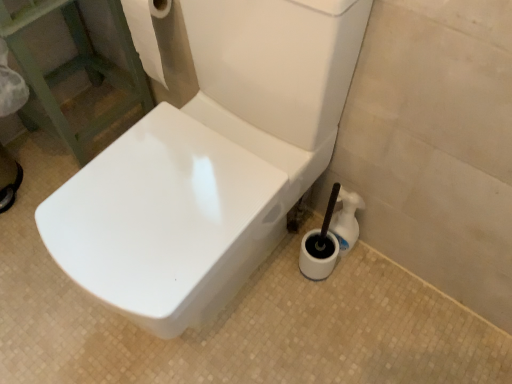
Locate an element on the screen. This screenshot has height=384, width=512. white glossy toilet brush at lower right is located at coordinates (346, 220).

Describe the element at coordinates (210, 162) in the screenshot. I see `white glossy toilet at center` at that location.

Identify the location of white paper towel at upper left. The image size is (512, 384). (147, 32).

The height and width of the screenshot is (384, 512). I want to click on white glossy toilet brush at lower right, so click(x=346, y=220).

Based on the photo, is white paper towel at upper left directly adjacent to white glossy toilet brush at lower right?

No, white paper towel at upper left is not touching white glossy toilet brush at lower right.

Is point (144, 39) positioned before point (346, 192)?

No.

Is white paper towel at upper left looking in the opposite direction of white glossy toilet brush at lower right?

That's not correct — white paper towel at upper left is not looking away from white glossy toilet brush at lower right.

Is white glossy toilet brush at lower right inside white paper towel at upper left?

No, white glossy toilet brush at lower right is not inside white paper towel at upper left.

Considering the relative sizes of white glossy toilet brush at lower right and white paper towel at upper left in the image provided, is white glossy toilet brush at lower right taller than white paper towel at upper left?

Incorrect, the height of white glossy toilet brush at lower right is not larger of that of white paper towel at upper left.

You are a GUI agent. You are given a task and a screenshot of the screen. Output one action in this format:
    pyautogui.click(x=<x>, y=<y>)
    Task: Click on the cleaning product behind the white paper towel at upper left
    The width and height of the screenshot is (512, 384).
    Given the screenshot: What is the action you would take?
    pyautogui.click(x=346, y=220)

Considering the sizes of objects white glossy toilet brush at lower right and white paper towel at upper left in the image provided, who is bigger, white glossy toilet brush at lower right or white paper towel at upper left?

white paper towel at upper left is bigger.

Considering the relative sizes of white glossy toilet brush at lower right and white paper towel at upper left in the image provided, is white glossy toilet brush at lower right wider than white paper towel at upper left?

In fact, white glossy toilet brush at lower right might be narrower than white paper towel at upper left.

Would you say white glossy toilet at center is a long distance from white glossy toilet brush at lower right?

No, white glossy toilet at center is not far away from white glossy toilet brush at lower right.

Is white glossy toilet at center not inside white glossy toilet brush at lower right?

white glossy toilet at center is positioned outside white glossy toilet brush at lower right.

Is white glossy toilet at center positioned with its back to white glossy toilet brush at lower right?

No, white glossy toilet at center's orientation is not away from white glossy toilet brush at lower right.

Can you confirm if white glossy toilet at center is taller than white paper towel at upper left?

Yes, white glossy toilet at center is taller than white paper towel at upper left.

Is white glossy toilet at center to the left or to the right of white paper towel at upper left in the image?

white glossy toilet at center is to the right of white paper towel at upper left.

From a real-world perspective, which object rests below the other?

white glossy toilet at center is physically lower.

Can you confirm if white glossy toilet at center is thinner than white paper towel at upper left?

Incorrect, the width of white glossy toilet at center is not less than that of white paper towel at upper left.

From the image's perspective, is white paper towel at upper left located above or below white glossy toilet at center?

white paper towel at upper left is above white glossy toilet at center.

Does point (143, 65) come farther from viewer compared to point (211, 91)?

Yes.

Can you confirm if white paper towel at upper left is smaller than white glossy toilet at center?

Indeed, white paper towel at upper left has a smaller size compared to white glossy toilet at center.

Does white paper towel at upper left have a greater height compared to white glossy toilet at center?

No, white paper towel at upper left is not taller than white glossy toilet at center.

Is white glossy toilet brush at lower right wider or thinner than white glossy toilet at center?

Considering their sizes, white glossy toilet brush at lower right looks slimmer than white glossy toilet at center.

From a real-world perspective, who is located higher, white glossy toilet brush at lower right or white glossy toilet at center?

From a 3D spatial view, white glossy toilet at center is above.

Based on the photo, considering the sizes of white glossy toilet brush at lower right and white glossy toilet at center in the image, is white glossy toilet brush at lower right taller or shorter than white glossy toilet at center?

In the image, white glossy toilet brush at lower right appears to be shorter than white glossy toilet at center.

Does white glossy toilet brush at lower right contain white glossy toilet at center?

No, white glossy toilet at center is not surrounded by white glossy toilet brush at lower right.

Where is `toilet paper in front of the white glossy toilet brush at lower right`? This screenshot has height=384, width=512. toilet paper in front of the white glossy toilet brush at lower right is located at coordinates click(x=147, y=32).

Locate an element on the screen. The image size is (512, 384). toilet paper to the left of white glossy toilet brush at lower right is located at coordinates (147, 32).

Based on their spatial positions, is white paper towel at upper left or white glossy toilet at center closer to white glossy toilet brush at lower right?

The object closer to white glossy toilet brush at lower right is white glossy toilet at center.

From the image, which object appears to be nearer to white glossy toilet at center, white glossy toilet brush at lower right or white paper towel at upper left?

Among the two, white glossy toilet brush at lower right is located nearer to white glossy toilet at center.

Based on their spatial positions, is white glossy toilet at center or white glossy toilet brush at lower right closer to white paper towel at upper left?

white glossy toilet at center lies closer to white paper towel at upper left than the other object.

Looking at the image, which one is located closer to white glossy toilet brush at lower right, white glossy toilet at center or white paper towel at upper left?

Based on the image, white glossy toilet at center appears to be nearer to white glossy toilet brush at lower right.

Estimate the real-world distances between objects in this image. Which object is further from white glossy toilet at center, white paper towel at upper left or white glossy toilet brush at lower right?

white paper towel at upper left is positioned further to the anchor white glossy toilet at center.

From the image, which object appears to be farther from white paper towel at upper left, white glossy toilet brush at lower right or white glossy toilet at center?

Among the two, white glossy toilet brush at lower right is located further to white paper towel at upper left.

Image resolution: width=512 pixels, height=384 pixels. Find the location of `toilet paper positioned between white glossy toilet at center and white glossy toilet brush at lower right from near to far`. toilet paper positioned between white glossy toilet at center and white glossy toilet brush at lower right from near to far is located at coordinates (147, 32).